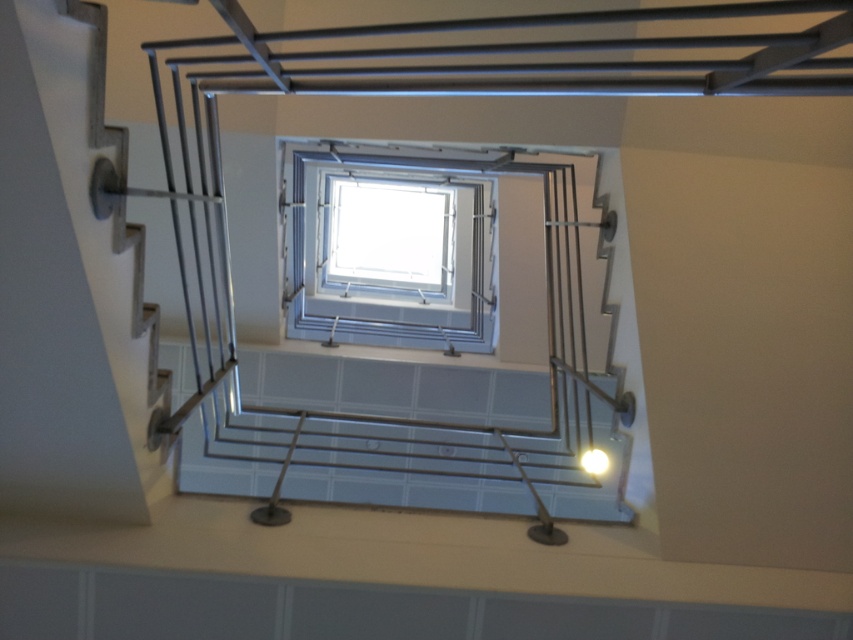
Can you confirm if transparent glass window at center is bigger than bright yellow bulb at center?

Indeed, transparent glass window at center has a larger size compared to bright yellow bulb at center.

Does point (373, 188) come behind point (599, 470)?

Yes, it is behind point (599, 470).

Find the location of a particular element. The image size is (853, 640). transparent glass window at center is located at coordinates point(387,252).